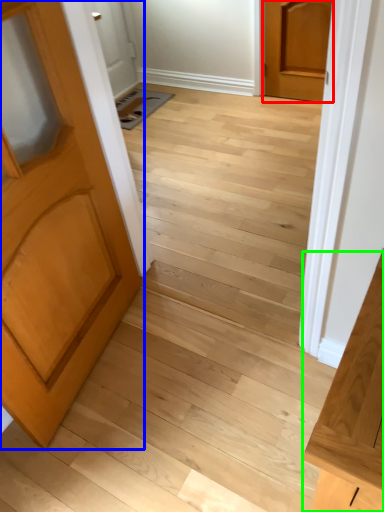
Question: Considering the real-world distances, which object is closest to door (highlighted by a red box)? door (highlighted by a blue box) or vanity (highlighted by a green box).

Choices:
 (A) door
 (B) vanity

Answer: (A)